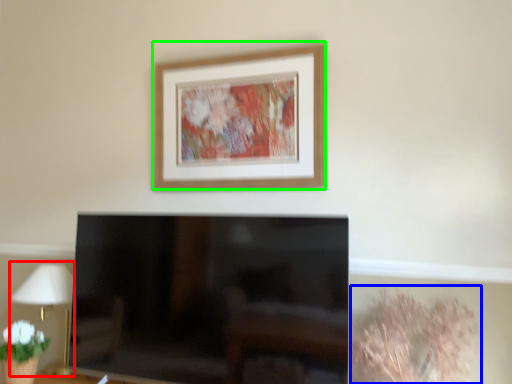
Question: Considering the real-world distances, which object is farthest from table lamp (highlighted by a red box)? plant (highlighted by a blue box) or picture frame (highlighted by a green box)?

Choices:
 (A) plant
 (B) picture frame

Answer: (A)